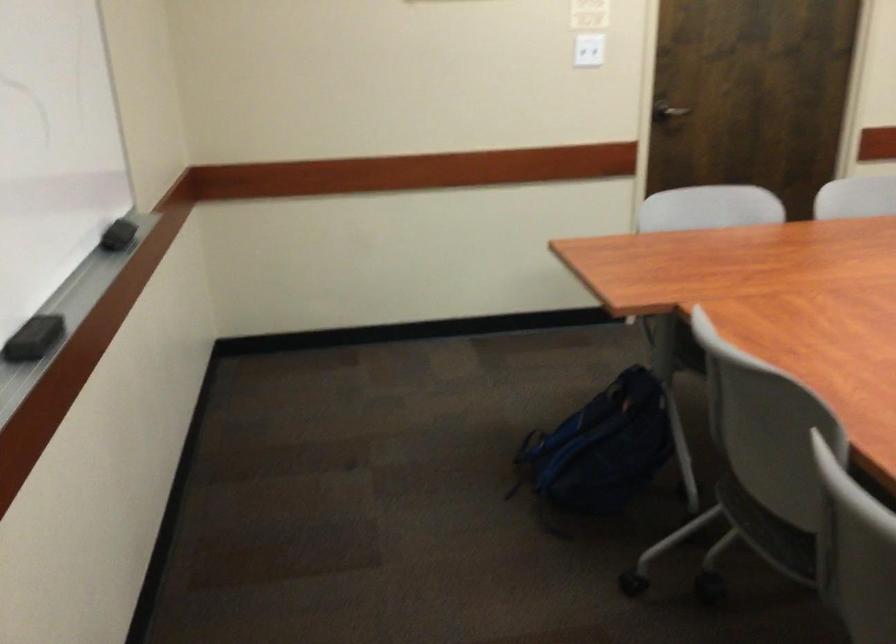
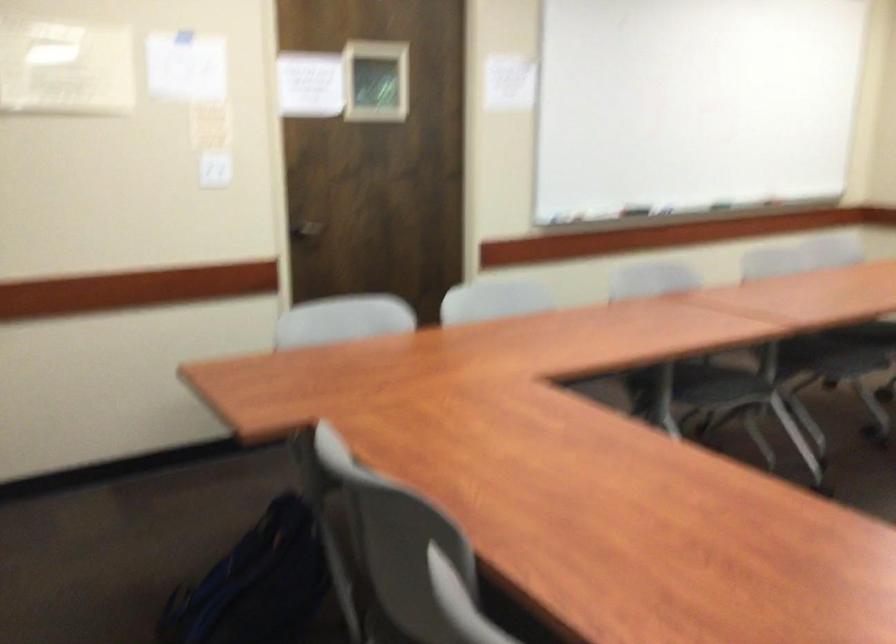
Question: The camera is either moving clockwise (left) or counter-clockwise (right) around the object. The first image is from the beginning of the video and the second image is from the end. Is the camera moving left or right when shooting the video?

Choices:
 (A) Left
 (B) Right

Answer: (A)